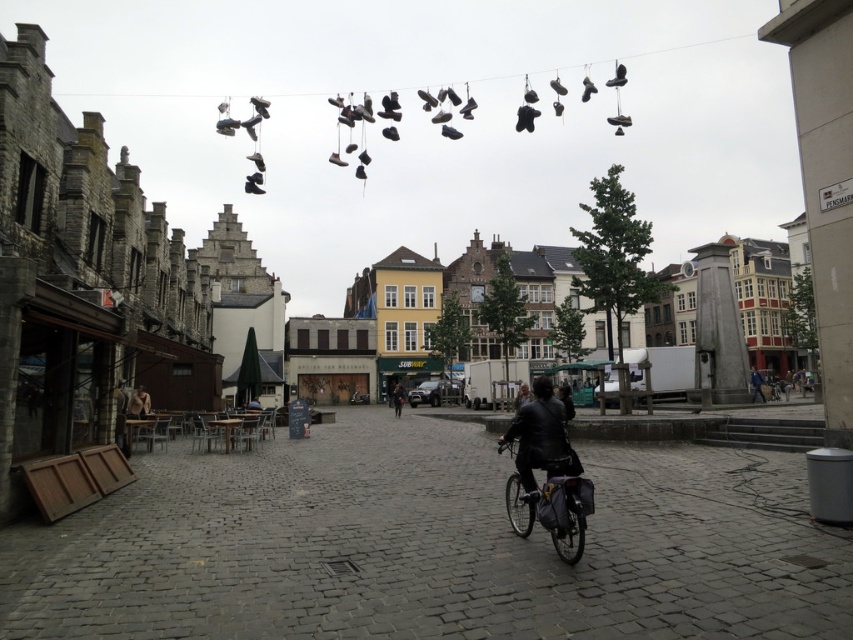
Question: Which point is farther to the camera?

Choices:
 (A) pyautogui.click(x=556, y=490)
 (B) pyautogui.click(x=395, y=416)
 (C) pyautogui.click(x=550, y=452)
 (D) pyautogui.click(x=761, y=381)

Answer: (B)

Question: Does blue denim jacket at center come in front of dark brown leather jacket at center?

Choices:
 (A) yes
 (B) no

Answer: (A)

Question: In this image, where is leather jacket at center located relative to blue denim jacket at center?

Choices:
 (A) below
 (B) above

Answer: (A)

Question: Does blue denim jacket at center appear under dark brown leather jacket at center?

Choices:
 (A) no
 (B) yes

Answer: (A)

Question: Among these objects, which one is farthest from the camera?

Choices:
 (A) leather jacket at center
 (B) blue denim jacket at center
 (C) dark brown leather jacket at center

Answer: (C)

Question: Which object is positioned closest to the shiny metallic bicycle at center?

Choices:
 (A) leather jacket at center
 (B) dark brown leather jacket at center
 (C) blue denim jacket at center

Answer: (A)